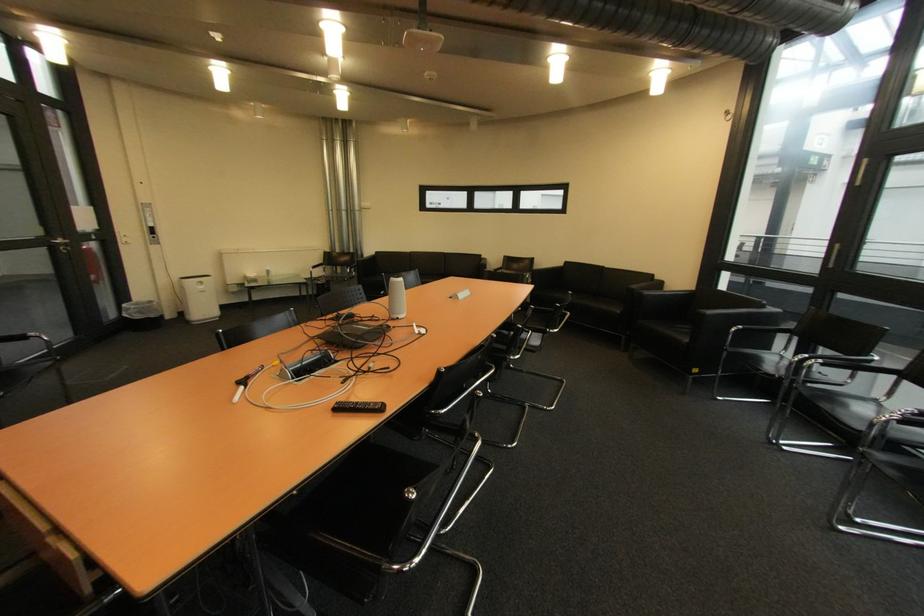
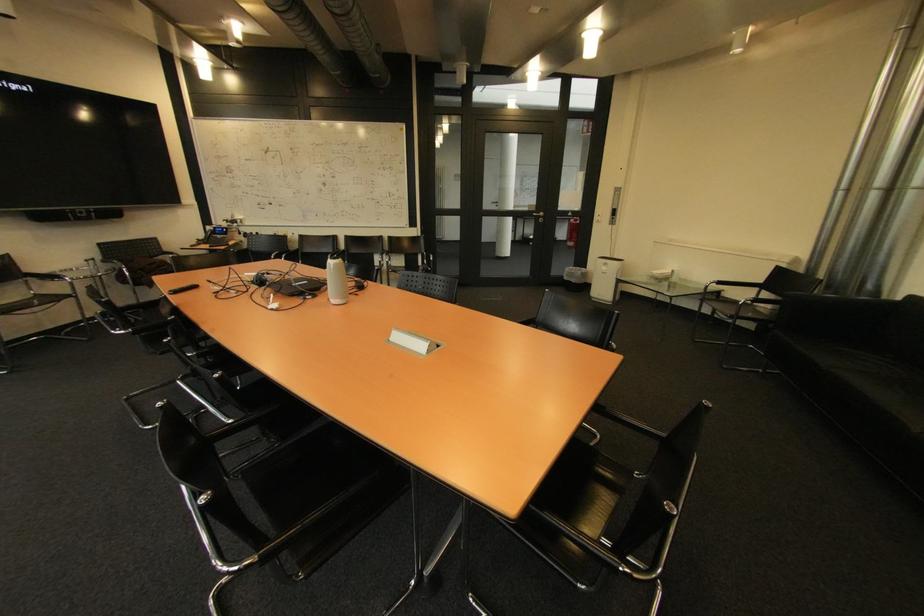
Question: I am providing you with two images of the same scene from different viewpoints. Please identify which objects are invisible in image2.

Choices:
 (A) sofa sitting surface
 (B) chrome chair armrest
 (C) chair sitting surface
 (D) red jug spout

Answer: (C)